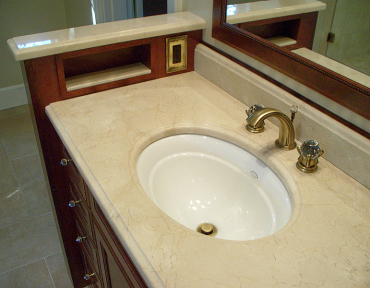
Find the location of `knobs`. knobs is located at coordinates (65, 162), (75, 202), (81, 240), (86, 276).